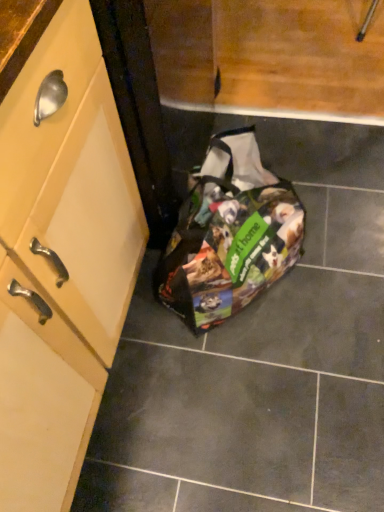
This screenshot has width=384, height=512. I want to click on vacant region to the right of printed fabric bag at lower center, so click(x=350, y=225).